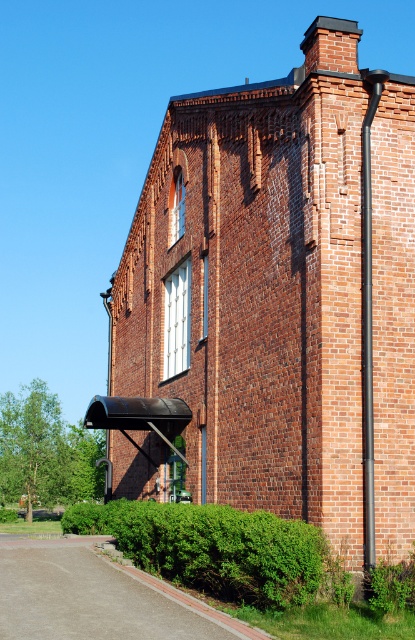
Question: Does green leafy hedge at lower left appear on the right side of black metal pipe at right?

Choices:
 (A) no
 (B) yes

Answer: (A)

Question: Does brick chimney at upper right appear on the right side of green leafy hedge at lower left?

Choices:
 (A) no
 (B) yes

Answer: (B)

Question: Which point is closer to the camera taking this photo?

Choices:
 (A) (365, 394)
 (B) (287, 285)
 (C) (173, 540)

Answer: (A)

Question: Which of these objects is positioned farthest from the green leafy hedge at lower left?

Choices:
 (A) brick chimney at upper right
 (B) black metal pipe at right

Answer: (B)

Question: Considering the real-world distances, which object is closest to the black metal pipe at right?

Choices:
 (A) green leafy hedge at lower left
 (B) brick chimney at upper right

Answer: (A)

Question: Does green leafy hedge at lower left appear on the left side of black metal pipe at right?

Choices:
 (A) yes
 (B) no

Answer: (A)